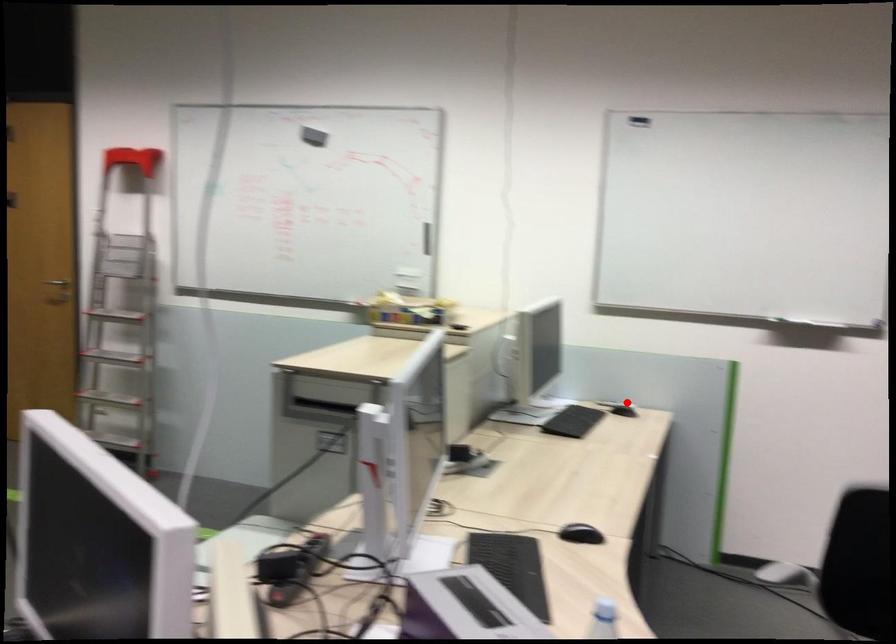
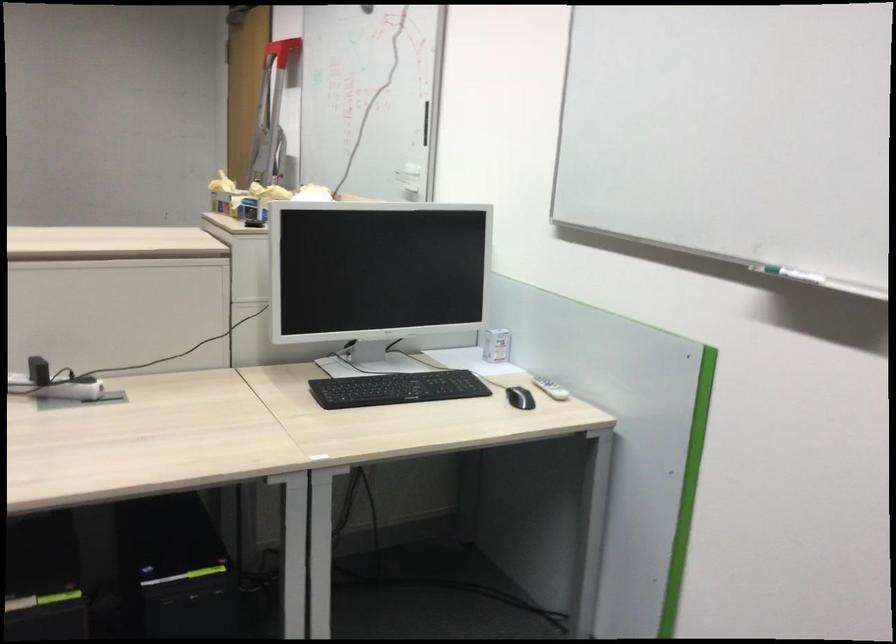
Question: I am providing you with two images of the same scene from different viewpoints. In image1, a red point is highlighted. Considering the same 3D point in image2, which of the following is correct?

Choices:
 (A) It is closer
 (B) It is farther

Answer: (A)